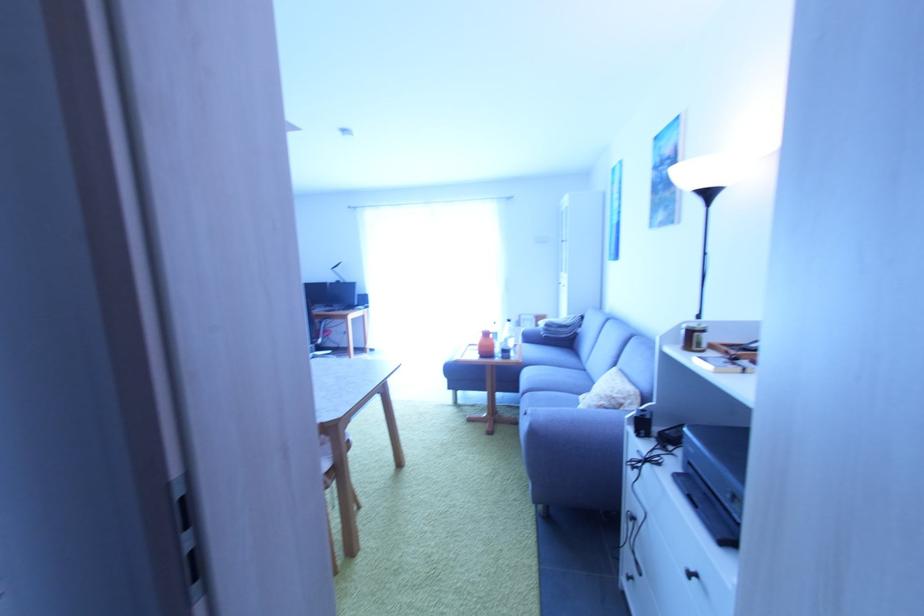
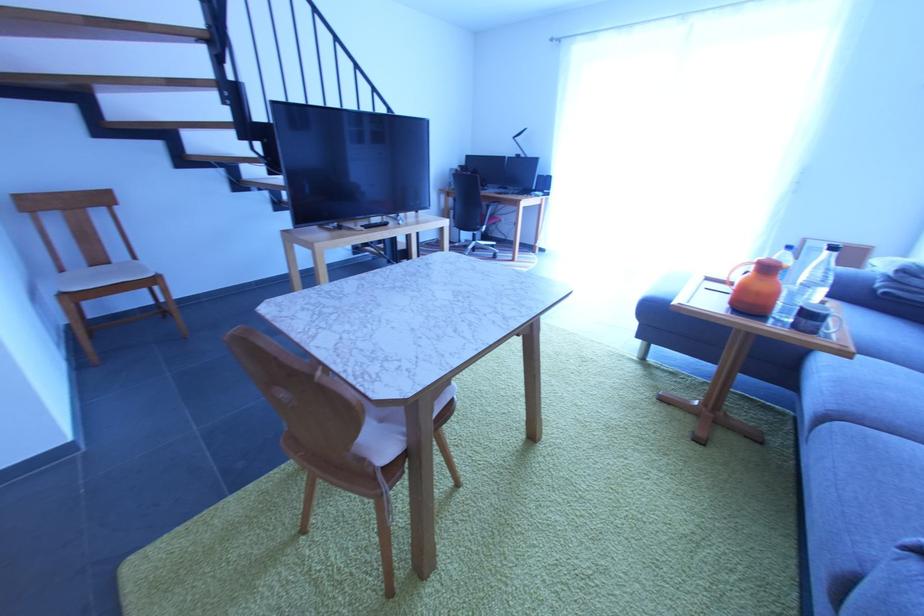
Locate, in the second image, the point that corresponds to the point at 514,360 in the first image.

(819, 334)